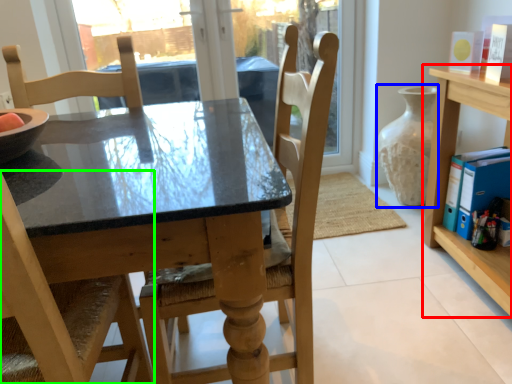
Question: Estimate the real-world distances between objects in this image. Which object is closer to shelf (highlighted by a red box), glass vase (highlighted by a blue box) or chair (highlighted by a green box)?

Choices:
 (A) glass vase
 (B) chair

Answer: (A)